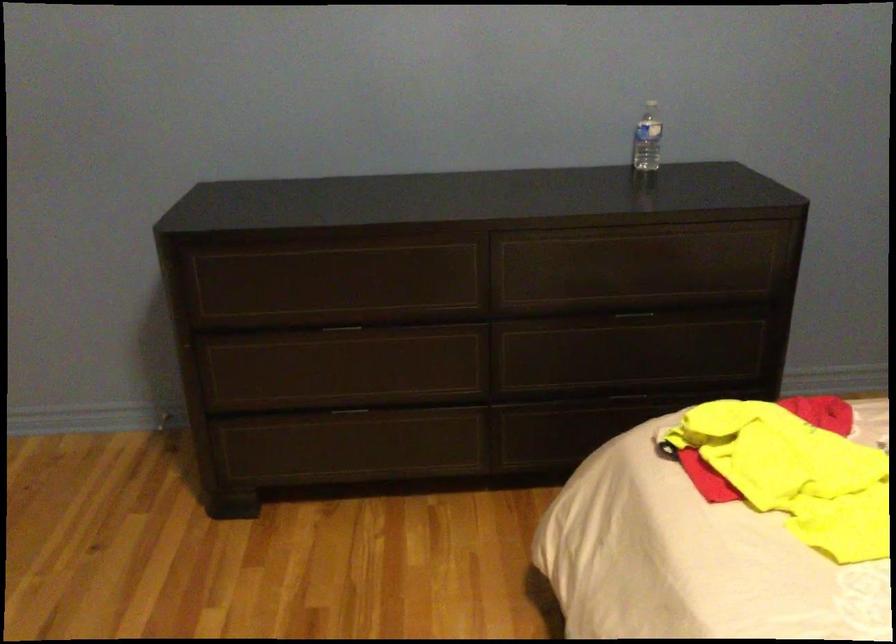
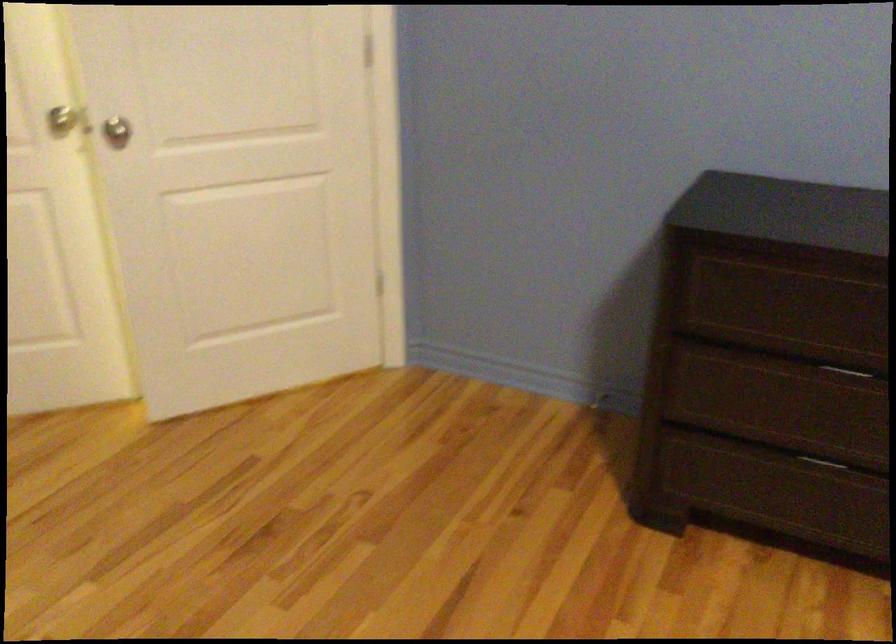
Question: The camera is either moving clockwise (left) or counter-clockwise (right) around the object. The first image is from the beginning of the video and the second image is from the end. Is the camera moving left or right when shooting the video?

Choices:
 (A) Left
 (B) Right

Answer: (B)